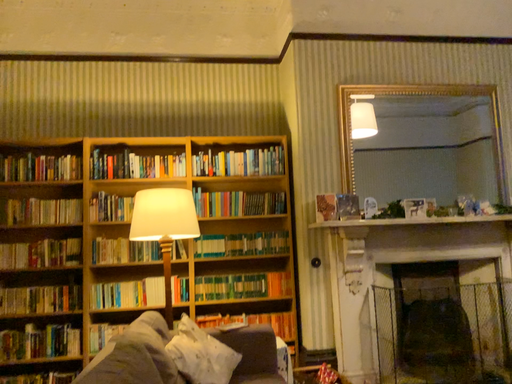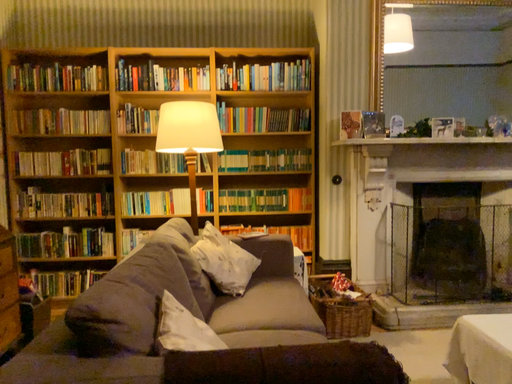
Question: Which way did the camera rotate in the video?

Choices:
 (A) rotated upward
 (B) rotated downward

Answer: (B)